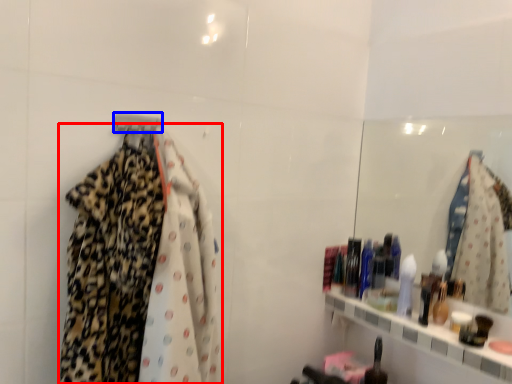
Question: Which object is closer to the camera taking this photo, fancy dress (highlighted by a red box) or hanger (highlighted by a blue box)?

Choices:
 (A) fancy dress
 (B) hanger

Answer: (A)